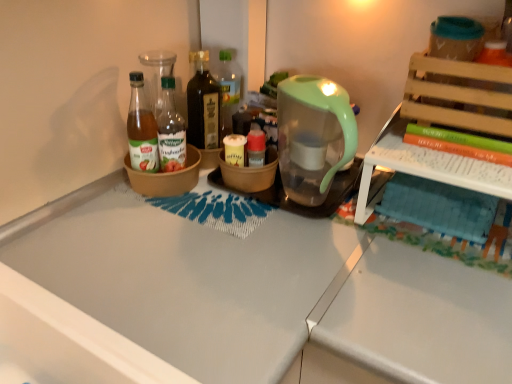
Image resolution: width=512 pixels, height=384 pixels. In order to click on free location to the right of green glass bottle at center, which is counted as the third bottle, starting from the right in this screenshot , I will do `click(232, 203)`.